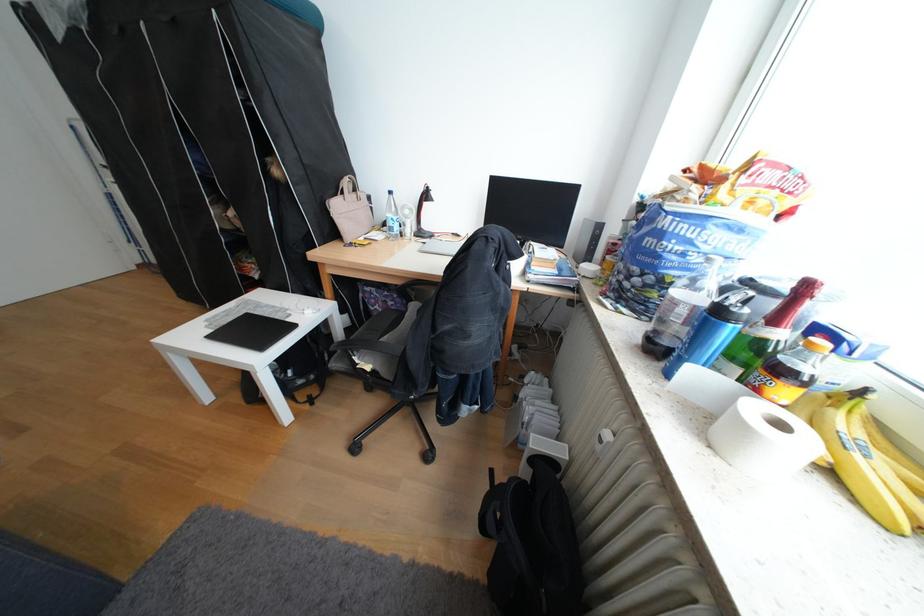
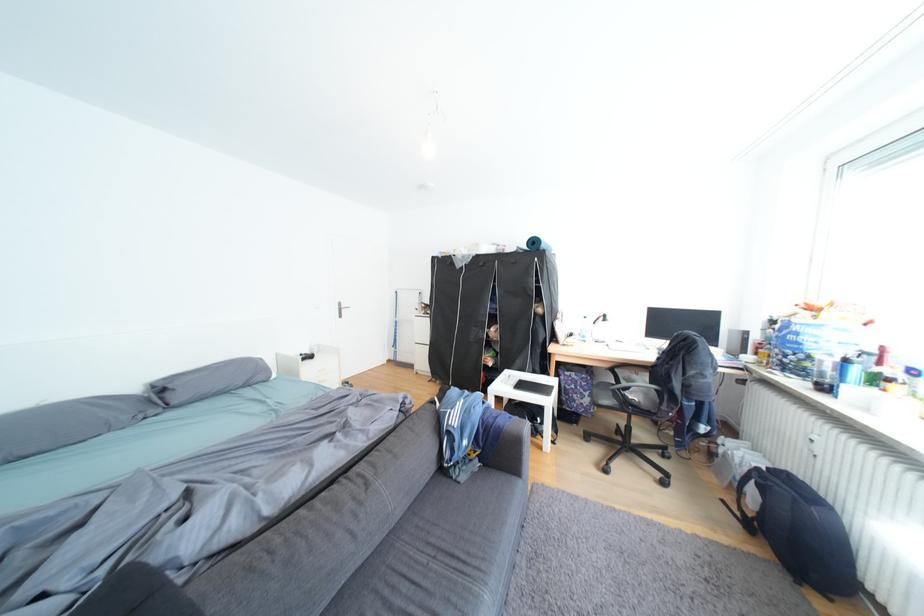
Find the pixel in the second image that matches the point at 355,193 in the first image.

(570, 318)